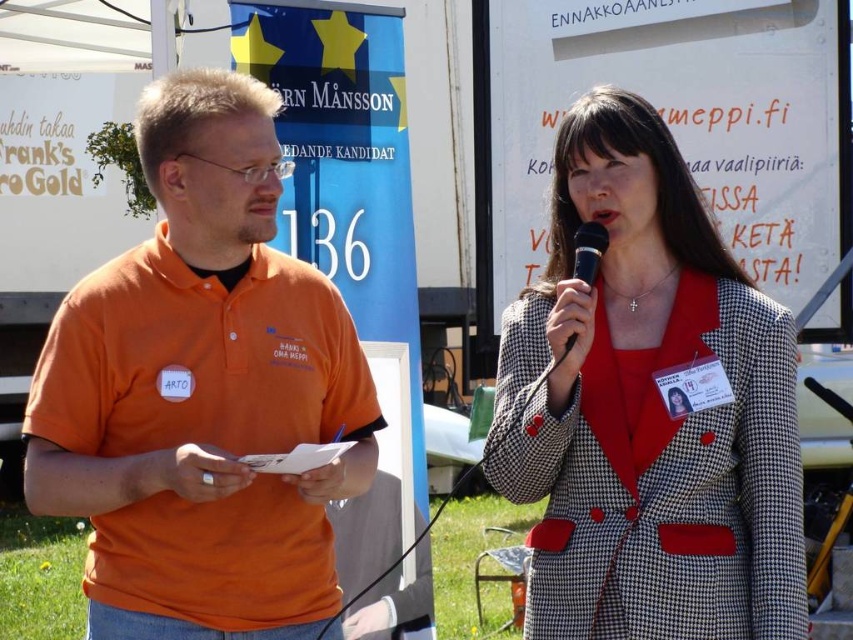
Question: Which of the following is the farthest from the observer?

Choices:
 (A) black plastic microphone at upper center
 (B) orange cotton polo shirt at left
 (C) houndstooth fabric blazer at center

Answer: (A)

Question: Which point is closer to the camera taking this photo?

Choices:
 (A) (173, 198)
 (B) (700, 220)
 (C) (590, 230)

Answer: (A)

Question: Is orange cotton polo shirt at left above houndstooth fabric blazer at center?

Choices:
 (A) no
 (B) yes

Answer: (A)

Question: Does orange cotton polo shirt at left have a larger size compared to houndstooth fabric blazer at center?

Choices:
 (A) no
 (B) yes

Answer: (B)

Question: Which point is closer to the camera?

Choices:
 (A) (596, 260)
 (B) (59, 460)

Answer: (B)

Question: Is orange cotton polo shirt at left to the right of houndstooth fabric blazer at center from the viewer's perspective?

Choices:
 (A) no
 (B) yes

Answer: (A)